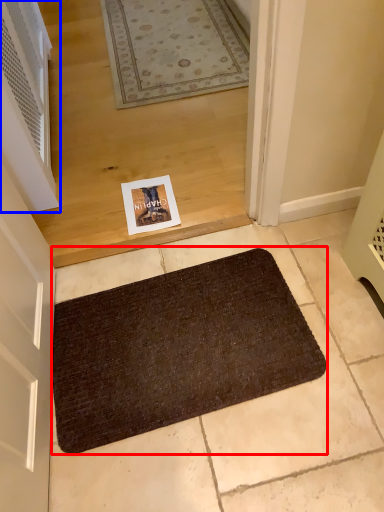
Question: Which object is further to the camera taking this photo, bath mat (highlighted by a red box) or air conditioner (highlighted by a blue box)?

Choices:
 (A) bath mat
 (B) air conditioner

Answer: (B)